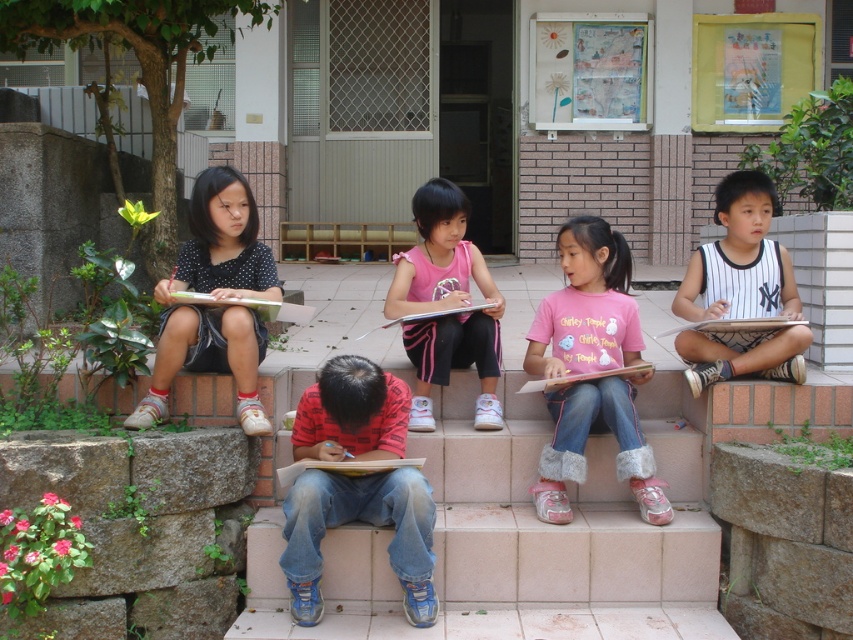
Question: Among these objects, which one is farthest from the camera?

Choices:
 (A) pink fabric shirt at center
 (B) white striped jersey at right
 (C) pink cotton shirt at center

Answer: (A)

Question: Which of the following is the closest to the observer?

Choices:
 (A) (712, 330)
 (B) (773, 333)
 (C) (241, 177)
 (D) (645, 481)

Answer: (D)

Question: In this image, where is pink fabric at center located relative to white striped jersey at right?

Choices:
 (A) above
 (B) below

Answer: (B)

Question: Is pink fabric at center to the right of pink cotton shirt at center from the viewer's perspective?

Choices:
 (A) no
 (B) yes

Answer: (A)

Question: Does matte paper book at center come behind matte pink book at center?

Choices:
 (A) no
 (B) yes

Answer: (A)

Question: Which point is farther to the camera?

Choices:
 (A) (727, 321)
 (B) (395, 458)

Answer: (A)